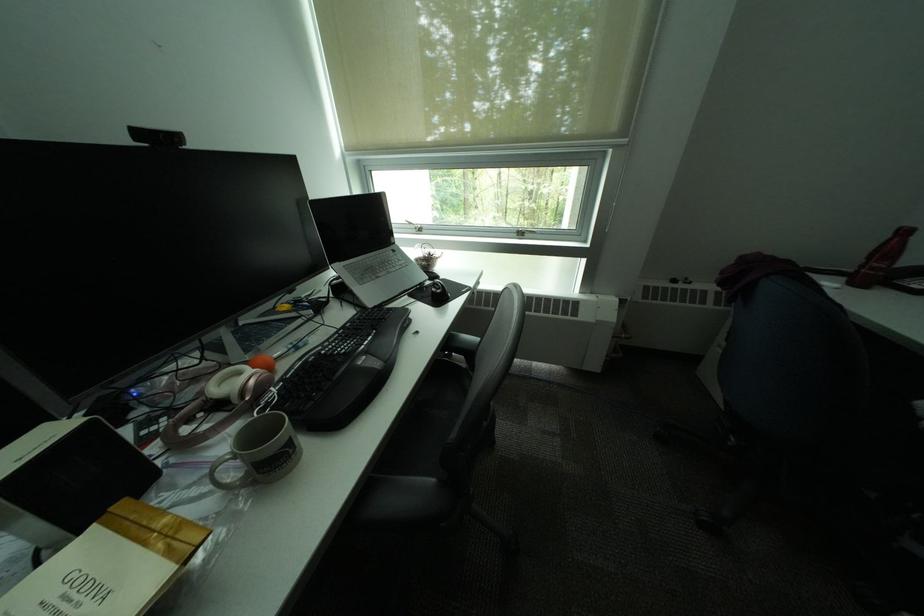
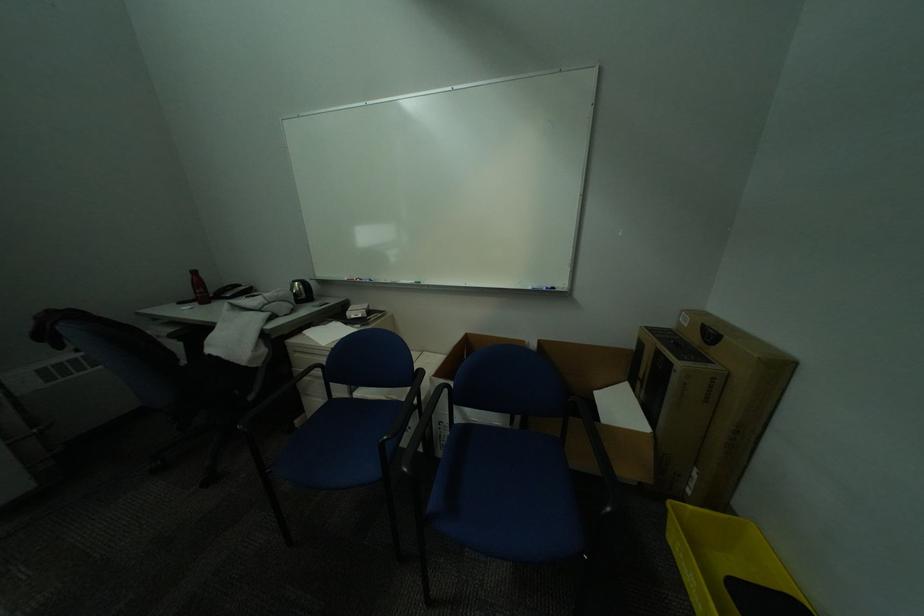
Find the pixel in the second image that matches (x=854, y=280) in the first image.

(208, 304)